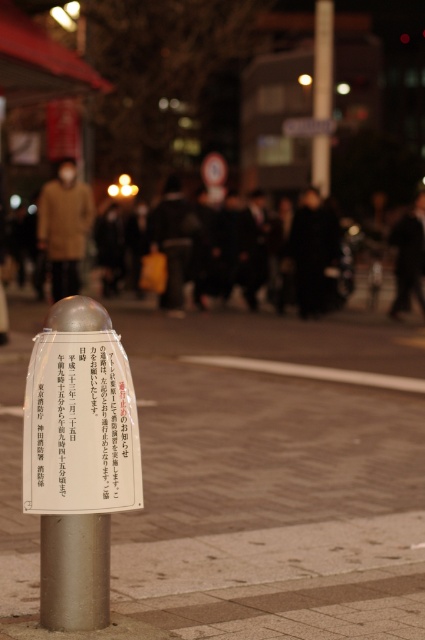
Question: Which is nearer to the black paper sign at center?

Choices:
 (A) metallic silver parking meter at center
 (B) brown smooth curb at lower center
 (C) silver metallic pole at lower center

Answer: (A)

Question: Which point appears farthest from the camera in this image?

Choices:
 (A) (320, 83)
 (B) (116, 464)

Answer: (A)

Question: Does metallic silver parking meter at center appear under dark gray fabric crowd at center?

Choices:
 (A) no
 (B) yes

Answer: (B)

Question: Among these objects, which one is nearest to the camera?

Choices:
 (A) silver metallic pole at upper center
 (B) metallic silver parking meter at center
 (C) black paper sign at center

Answer: (C)

Question: Is black paper sign at center to the right of dark gray fabric crowd at center from the viewer's perspective?

Choices:
 (A) yes
 (B) no

Answer: (B)

Question: Can you confirm if metallic silver parking meter at center is positioned above dark gray fabric crowd at center?

Choices:
 (A) no
 (B) yes

Answer: (A)